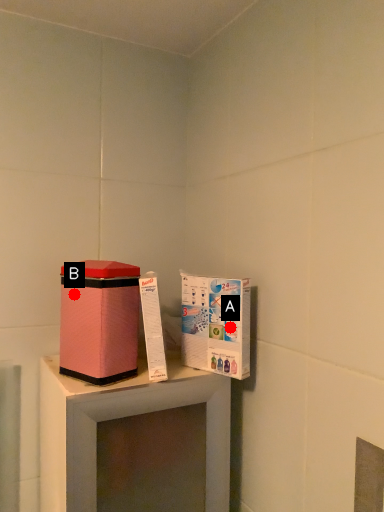
Question: Two points are circled on the image, labeled by A and B beside each circle. Which point is farther to the camera?

Choices:
 (A) A is further
 (B) B is further

Answer: (A)